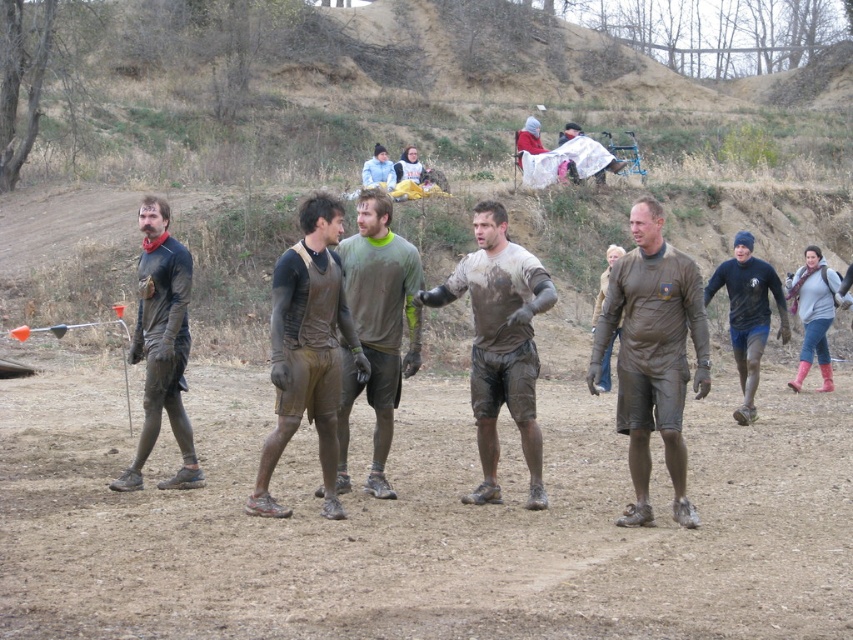
Is brown muddy ground at center bigger than light blue fabric at center?

No.

Which of these two, brown muddy ground at center or light blue fabric at center, stands taller?

light blue fabric at center

Is point (776, 557) in front of point (381, 170)?

Yes, point (776, 557) is closer to viewer.

Identify the location of brown muddy ground at center. Image resolution: width=853 pixels, height=640 pixels. (422, 524).

Does muddy uniform at center appear over matte black outfit at left?

Incorrect, muddy uniform at center is not positioned above matte black outfit at left.

Find the location of a particular element. This screenshot has width=853, height=640. muddy uniform at center is located at coordinates (653, 355).

Does muddy rubber shorts at center appear on the right side of light blue fabric at center?

Indeed, muddy rubber shorts at center is positioned on the right side of light blue fabric at center.

Does muddy rubber shorts at center have a lesser width compared to light blue fabric at center?

Correct, muddy rubber shorts at center's width is less than light blue fabric at center's.

What do you see at coordinates (306, 349) in the screenshot? I see `muddy rubber shorts at center` at bounding box center [306, 349].

You are a GUI agent. You are given a task and a screenshot of the screen. Output one action in this format:
    pyautogui.click(x=<x>, y=<y>)
    Task: Click on the muddy rubber shorts at center
    
    Given the screenshot: What is the action you would take?
    pyautogui.click(x=306, y=349)